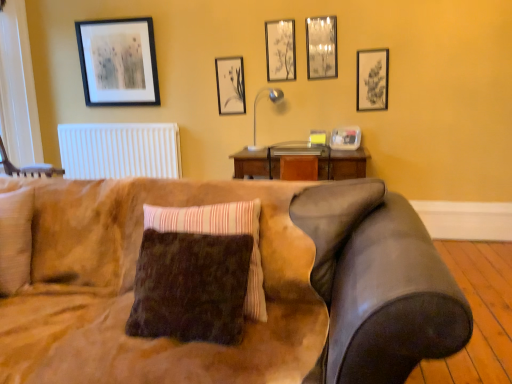
Question: Considering the relative sizes of suede couch at center and clear plastic container at upper right, positioned as the fifth picture frame in left-to-right order, in the image provided, is suede couch at center smaller than clear plastic container at upper right, positioned as the fifth picture frame in left-to-right order,?

Choices:
 (A) yes
 (B) no

Answer: (B)

Question: Considering the relative positions of suede couch at center and clear plastic container at upper right, positioned as the fifth picture frame in left-to-right order, in the image provided, is suede couch at center to the left of clear plastic container at upper right, positioned as the fifth picture frame in left-to-right order, from the viewer's perspective?

Choices:
 (A) yes
 (B) no

Answer: (A)

Question: From a real-world perspective, is suede couch at center below clear plastic container at upper right, positioned as the fifth picture frame in left-to-right order?

Choices:
 (A) no
 (B) yes

Answer: (B)

Question: Can you confirm if suede couch at center is bigger than clear plastic container at upper right, the second picture frame from the right?

Choices:
 (A) yes
 (B) no

Answer: (A)

Question: Is suede couch at center taller than clear plastic container at upper right, the second picture frame from the right?

Choices:
 (A) yes
 (B) no

Answer: (A)

Question: Is suede couch at center surrounding clear plastic container at upper right, positioned as the fifth picture frame in left-to-right order?

Choices:
 (A) yes
 (B) no

Answer: (B)

Question: Does clear glass window at left have a smaller size compared to clear plastic container at upper right, the second picture frame from the right?

Choices:
 (A) yes
 (B) no

Answer: (B)

Question: From the image's perspective, is clear glass window at left above clear plastic container at upper right, the second picture frame from the right?

Choices:
 (A) yes
 (B) no

Answer: (A)

Question: Considering the relative sizes of clear glass window at left and clear plastic container at upper right, the second picture frame from the right, in the image provided, is clear glass window at left shorter than clear plastic container at upper right, the second picture frame from the right,?

Choices:
 (A) no
 (B) yes

Answer: (A)

Question: Is the depth of clear glass window at left less than that of clear plastic container at upper right, the second picture frame from the right?

Choices:
 (A) yes
 (B) no

Answer: (A)

Question: Can you confirm if clear glass window at left is positioned to the left of clear plastic container at upper right, positioned as the fifth picture frame in left-to-right order?

Choices:
 (A) no
 (B) yes

Answer: (B)

Question: From a real-world perspective, is clear glass window at left beneath clear plastic container at upper right, positioned as the fifth picture frame in left-to-right order?

Choices:
 (A) yes
 (B) no

Answer: (B)

Question: Is wooden swivel chair at left not within brown fuzzy pillow at center?

Choices:
 (A) yes
 (B) no

Answer: (A)